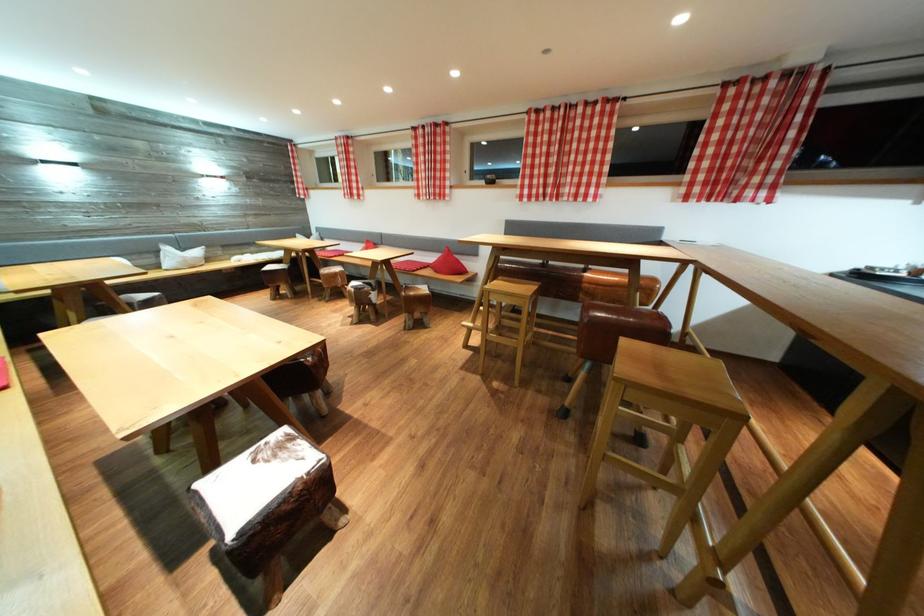
Locate an element on the screen. The height and width of the screenshot is (616, 924). sofa sitting surface is located at coordinates (134, 245).